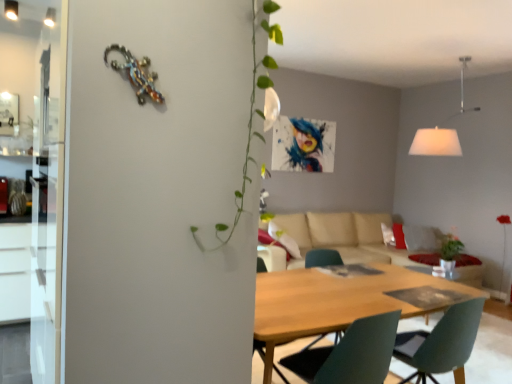
The width and height of the screenshot is (512, 384). What do you see at coordinates (350, 354) in the screenshot? I see `matte green chair at center` at bounding box center [350, 354].

Measure the distance between point (399, 261) and camera.

4.21 meters.

Locate an element on the screen. This screenshot has height=384, width=512. matte green chair at center is located at coordinates (350, 354).

How much distance is there between beige fabric couch at center and matte green chair at center?

beige fabric couch at center and matte green chair at center are 3.89 meters apart.

Would you say beige fabric couch at center is inside or outside matte green chair at center?

beige fabric couch at center is spatially situated outside matte green chair at center.

From a real-world perspective, which object stands above the other?

From a 3D spatial view, matte green chair at center is above.

Which object is closer to the camera, matte green chair at center or white fabric lampshade at upper right?

matte green chair at center.

Is matte green chair at center positioned with its back to white fabric lampshade at upper right?

No, white fabric lampshade at upper right is not at the back of matte green chair at center.

Is white fabric lampshade at upper right surrounded by matte green chair at center?

No, white fabric lampshade at upper right is not a part of matte green chair at center.

From the image's perspective, is white fabric lampshade at upper right beneath beige fabric couch at center?

Incorrect, from the image's perspective, white fabric lampshade at upper right is higher than beige fabric couch at center.

Which object is closer to the camera taking this photo, white fabric lampshade at upper right or beige fabric couch at center?

Positioned in front is beige fabric couch at center.

At what (x,y) coordinates should I click in order to perform the action: click on couch below the white fabric lampshade at upper right (from the image's perspective). Please return your answer as a coordinate pair (x, y). Looking at the image, I should click on (343, 237).

Choose the correct answer: Is white fabric lampshade at upper right inside beige fabric couch at center or outside it?

white fabric lampshade at upper right is outside beige fabric couch at center.

Looking at this image, considering the sizes of objects wooden table at center and beige fabric couch at center in the image provided, who is wider, wooden table at center or beige fabric couch at center?

Wider between the two is beige fabric couch at center.

Considering the points (300, 327) and (344, 246), which point is behind, point (300, 327) or point (344, 246)?

The point (344, 246) is farther.

Which of these two, wooden table at center or beige fabric couch at center, is bigger?

With larger size is beige fabric couch at center.

How many degrees apart are the facing directions of wooden table at center and beige fabric couch at center?

The angle between the facing direction of wooden table at center and the facing direction of beige fabric couch at center is 180 degrees.

Consider the image. Between beige fabric couch at center and wooden table at center, which one has less height?

wooden table at center.

From a real-world perspective, is beige fabric couch at center positioned under wooden table at center based on gravity?

No, from a real-world perspective, beige fabric couch at center is not below wooden table at center.

Which of these two, beige fabric couch at center or wooden table at center, is thinner?

wooden table at center.

Which object is closer to the camera taking this photo, beige fabric couch at center or wooden table at center?

wooden table at center.

Is white fabric lampshade at upper right wider than wooden table at center?

Correct, the width of white fabric lampshade at upper right exceeds that of wooden table at center.

Can you confirm if white fabric lampshade at upper right is bigger than wooden table at center?

No, white fabric lampshade at upper right is not bigger than wooden table at center.

From a real-world perspective, is white fabric lampshade at upper right positioned above or below wooden table at center?

white fabric lampshade at upper right is situated higher than wooden table at center in the real world.

Locate an element on the screen. The height and width of the screenshot is (384, 512). light fixture that appears above the wooden table at center (from the image's perspective) is located at coordinates (436, 142).

From the picture: Can you confirm if white fabric lampshade at upper right is smaller than matte green chair at center?

Actually, white fabric lampshade at upper right might be larger than matte green chair at center.

Which object is wider, white fabric lampshade at upper right or matte green chair at center?

white fabric lampshade at upper right.

Is white fabric lampshade at upper right completely or partially outside of matte green chair at center?

white fabric lampshade at upper right is positioned outside matte green chair at center.

From a real-world perspective, is white fabric lampshade at upper right physically located above or below matte green chair at center?

Clearly, from a real-world perspective, white fabric lampshade at upper right is above matte green chair at center.

At what (x,y) coordinates should I click in order to perform the action: click on couch above the matte green chair at center (from the image's perspective). Please return your answer as a coordinate pair (x, y). The width and height of the screenshot is (512, 384). Looking at the image, I should click on (343, 237).

This screenshot has width=512, height=384. I want to click on chair below the white fabric lampshade at upper right (from a real-world perspective), so click(x=350, y=354).

From the image, which object appears to be farther from wooden table at center, matte green chair at center or beige fabric couch at center?

beige fabric couch at center lies further to wooden table at center than the other object.

Considering their positions, is matte green chair at center positioned closer to beige fabric couch at center than white fabric lampshade at upper right?

Among the two, white fabric lampshade at upper right is located nearer to beige fabric couch at center.

From the image, which object appears to be farther from beige fabric couch at center, wooden table at center or white fabric lampshade at upper right?

wooden table at center is further to beige fabric couch at center.

Which object lies further to the anchor point beige fabric couch at center, white fabric lampshade at upper right or matte green chair at center?

The object further to beige fabric couch at center is matte green chair at center.

Based on the photo, when comparing their distances from white fabric lampshade at upper right, does matte green chair at center or beige fabric couch at center seem closer?

The object closer to white fabric lampshade at upper right is beige fabric couch at center.

From the image, which object appears to be nearer to matte green chair at center, wooden table at center or beige fabric couch at center?

Based on the image, wooden table at center appears to be nearer to matte green chair at center.

From the image, which object appears to be farther from wooden table at center, white fabric lampshade at upper right or matte green chair at center?

white fabric lampshade at upper right.

Looking at the image, which one is located closer to matte green chair at center, white fabric lampshade at upper right or beige fabric couch at center?

Based on the image, white fabric lampshade at upper right appears to be nearer to matte green chair at center.

I want to click on couch between matte green chair at center and white fabric lampshade at upper right along the z-axis, so pyautogui.click(x=343, y=237).

Find the location of a particular element. Image resolution: width=512 pixels, height=384 pixels. chair positioned between wooden table at center and white fabric lampshade at upper right from near to far is located at coordinates (350, 354).

Locate an element on the screen. chair between wooden table at center and beige fabric couch at center along the z-axis is located at coordinates (350, 354).

This screenshot has width=512, height=384. Identify the location of couch between wooden table at center and white fabric lampshade at upper right in the front-back direction. (343, 237).